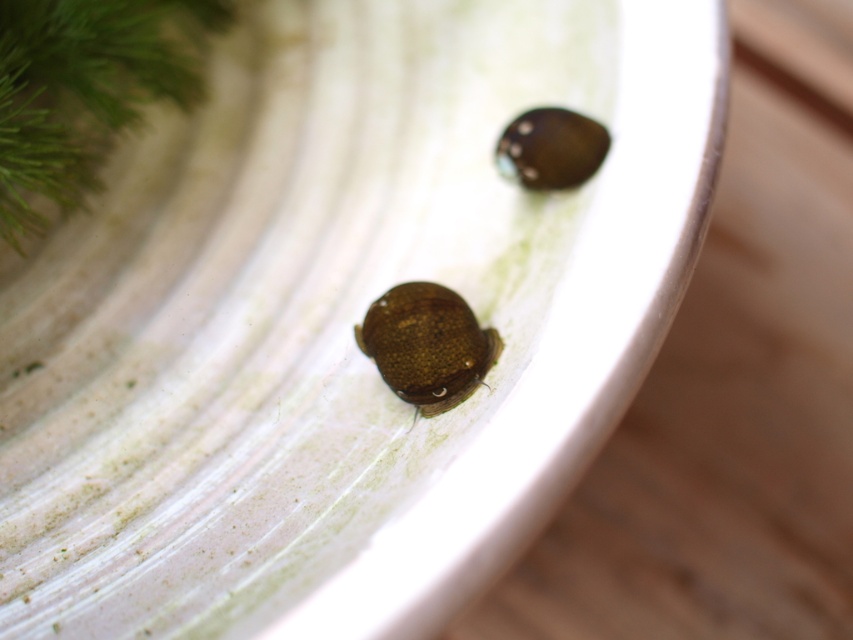
You are a photographer trying to capture a detailed shot of the two points in the image. Which point, point [51,52] or point [395,388], would appear larger in your photo?

Point [51,52] is closer to the viewer than point [395,388], so it would appear larger in the photo.

You are a chef preparing a dish and need to locate the dill and the beetle. According to the image, where is the green leafy dill at upper left in relation to the brown matte beetle at center?

The green leafy dill at upper left is to the left of the brown matte beetle at center.